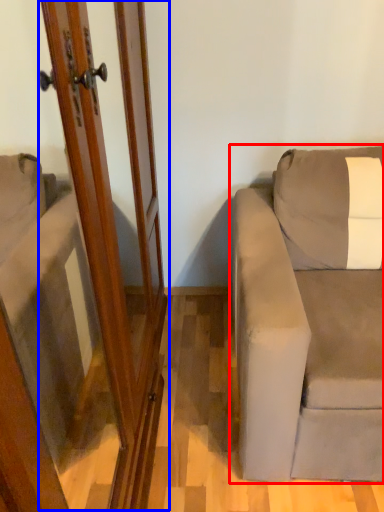
Question: Which object appears closest to the camera in this image, studio couch (highlighted by a red box) or screen door (highlighted by a blue box)?

Choices:
 (A) studio couch
 (B) screen door

Answer: (B)